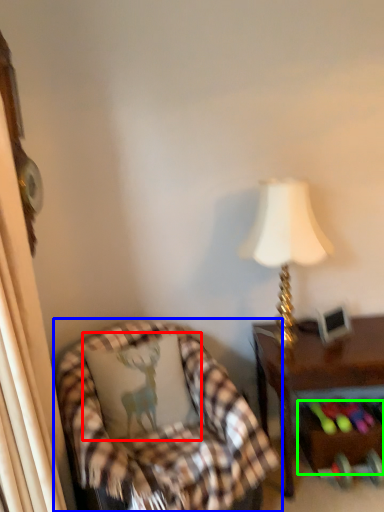
Question: Which object is positioned closest to pillow (highlighted by a red box)? Select from chair (highlighted by a blue box) and drawer (highlighted by a green box).

Choices:
 (A) chair
 (B) drawer

Answer: (A)